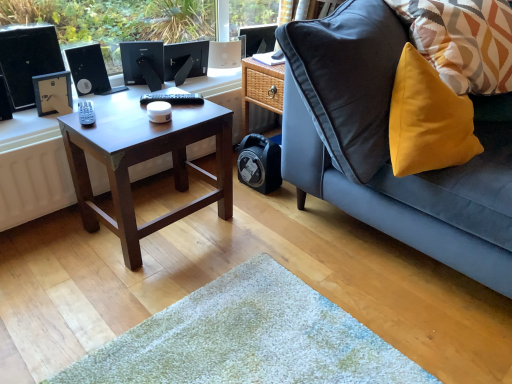
Identify the location of free location in front of dark brown wood coffee table at center. This screenshot has height=384, width=512. (138, 294).